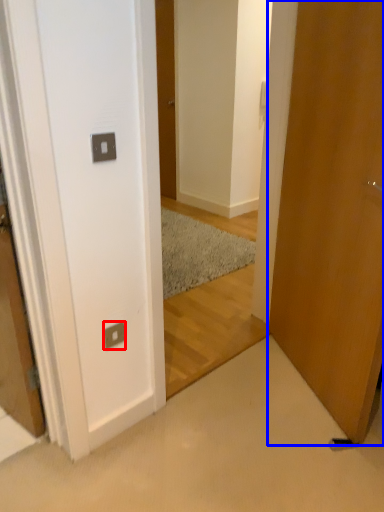
Question: Among these objects, which one is nearest to the camera, electric outlet (highlighted by a red box) or door (highlighted by a blue box)?

Choices:
 (A) electric outlet
 (B) door

Answer: (B)